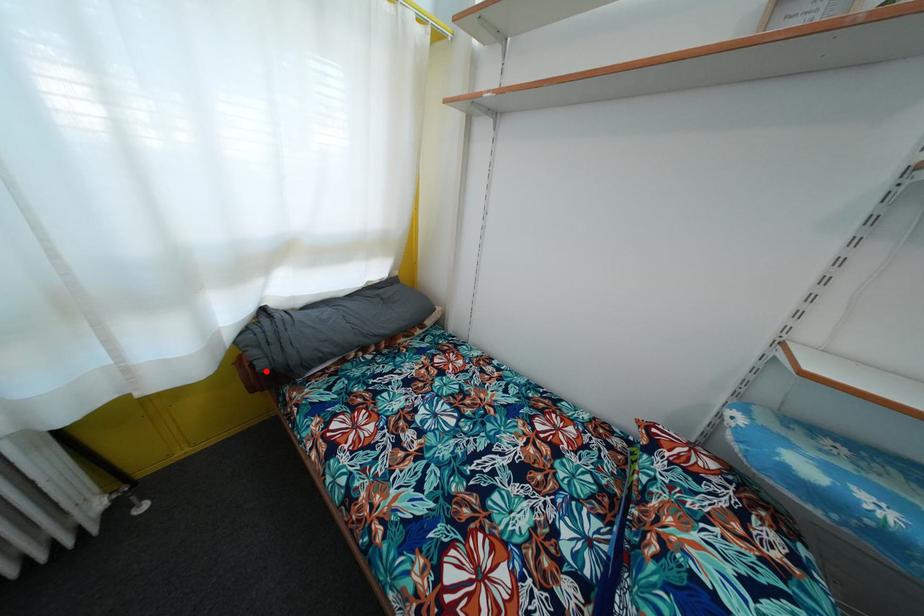
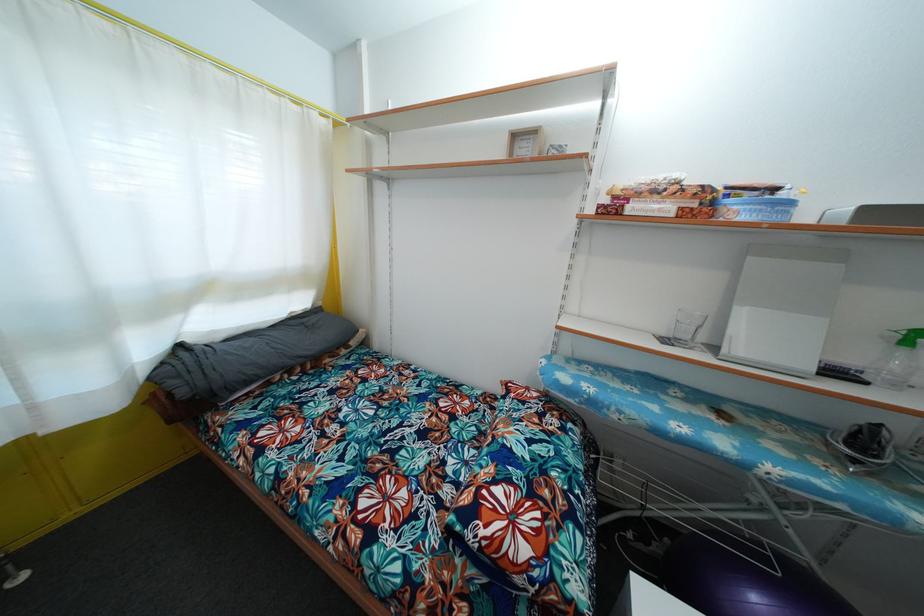
Find the pixel in the second image that matches the highlighted location in the first image.

(187, 399)